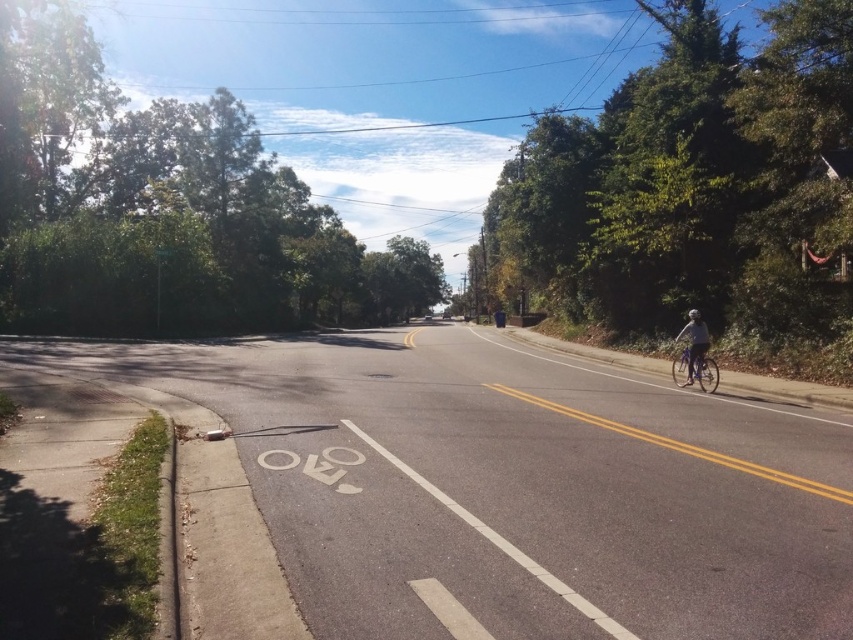
You are a pedestrian standing on the sidewalk on the left side of the road. You see a metallic silver bicycle at right and a black matte bicycle helmet at right. Which object is closer to the road edge where the cyclist is riding?

The metallic silver bicycle at right is closer to the road edge where the cyclist is riding because it is positioned to the left of the black matte bicycle helmet at right.

You are a delivery driver who needs to make a right turn onto a side street ahead. Your vehicle is 2.5 meters wide. There is a white painted bike lane at center on the road. Can your vehicle safely turn without encroaching into the bike lane?

The distance between the white painted bike lane at center and the camera is 4.45 meters. Since your vehicle is 2.5 meters wide, you should be able to make the turn safely without entering the bike lane, provided you position your vehicle appropriately.

You are a pedestrian walking on the sidewalk of a street with a cyclist nearby. You see the white painted bike lane at center and the gray fabric helmet at right. Which object is closer to you as you walk?

The white painted bike lane at center is in front of the gray fabric helmet at right, so it is closer to you as you walk on the sidewalk.